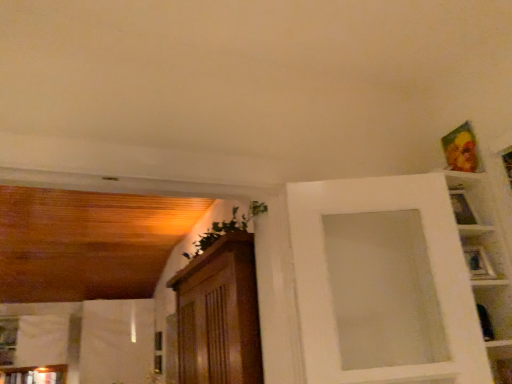
Question: Is metallic gold picture frame at upper right, the second picture frame when ordered from front to back, not near metallic silver picture frame at upper right, placed as the 2th picture frame when sorted from top to bottom?

Choices:
 (A) yes
 (B) no

Answer: (B)

Question: Is metallic gold picture frame at upper right, the second picture frame when ordered from front to back, directly adjacent to metallic silver picture frame at upper right, positioned as the first picture frame in front-to-back order?

Choices:
 (A) no
 (B) yes

Answer: (A)

Question: Does metallic gold picture frame at upper right, the 2th picture frame from the bottom, turn towards metallic silver picture frame at upper right, marked as the 1th picture frame in a bottom-to-top arrangement?

Choices:
 (A) yes
 (B) no

Answer: (B)

Question: From a real-world perspective, is metallic gold picture frame at upper right, the 2th picture frame from the bottom, on top of metallic silver picture frame at upper right, which is the 2th picture frame in back-to-front order?

Choices:
 (A) no
 (B) yes

Answer: (B)

Question: Is metallic gold picture frame at upper right, which appears as the first picture frame when viewed from the top, looking in the opposite direction of metallic silver picture frame at upper right, marked as the 1th picture frame in a bottom-to-top arrangement?

Choices:
 (A) yes
 (B) no

Answer: (B)

Question: Can you confirm if metallic gold picture frame at upper right, acting as the first picture frame starting from the back, is taller than metallic silver picture frame at upper right, which is the 2th picture frame in back-to-front order?

Choices:
 (A) yes
 (B) no

Answer: (A)

Question: Is metallic gold picture frame at upper right, acting as the first picture frame starting from the back, at the back of metallic silver picture frame at upper right, marked as the 1th picture frame in a bottom-to-top arrangement?

Choices:
 (A) yes
 (B) no

Answer: (B)

Question: From a real-world perspective, is metallic silver picture frame at upper right, marked as the 1th picture frame in a bottom-to-top arrangement, located higher than metallic gold picture frame at upper right, the second picture frame when ordered from front to back?

Choices:
 (A) yes
 (B) no

Answer: (B)

Question: From a real-world perspective, is metallic silver picture frame at upper right, which is the 2th picture frame in back-to-front order, positioned under metallic gold picture frame at upper right, the 2th picture frame from the bottom, based on gravity?

Choices:
 (A) yes
 (B) no

Answer: (A)

Question: From the image's perspective, does metallic silver picture frame at upper right, marked as the 1th picture frame in a bottom-to-top arrangement, appear lower than metallic gold picture frame at upper right, acting as the first picture frame starting from the back?

Choices:
 (A) no
 (B) yes

Answer: (B)

Question: Considering the relative positions of metallic silver picture frame at upper right, placed as the 2th picture frame when sorted from top to bottom, and metallic gold picture frame at upper right, which appears as the first picture frame when viewed from the top, in the image provided, is metallic silver picture frame at upper right, placed as the 2th picture frame when sorted from top to bottom, behind metallic gold picture frame at upper right, which appears as the first picture frame when viewed from the top,?

Choices:
 (A) no
 (B) yes

Answer: (A)

Question: Does metallic silver picture frame at upper right, placed as the 2th picture frame when sorted from top to bottom, have a larger size compared to metallic gold picture frame at upper right, the 2th picture frame from the bottom?

Choices:
 (A) no
 (B) yes

Answer: (A)

Question: Considering the positions of metallic silver picture frame at upper right, placed as the 2th picture frame when sorted from top to bottom, and metallic gold picture frame at upper right, the 2th picture frame from the bottom, in the image, is metallic silver picture frame at upper right, placed as the 2th picture frame when sorted from top to bottom, wider or thinner than metallic gold picture frame at upper right, the 2th picture frame from the bottom,?

Choices:
 (A) wide
 (B) thin

Answer: (A)